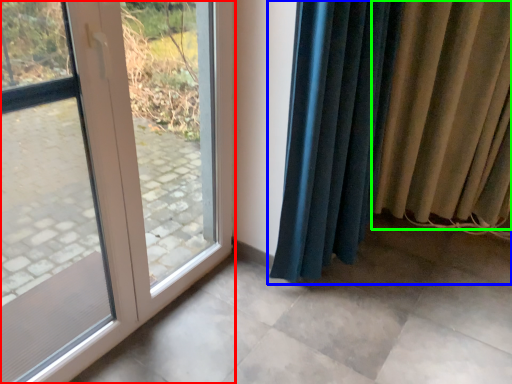
Question: Based on their relative distances, which object is farther from door (highlighted by a red box)? Choose from curtain (highlighted by a blue box) and curtain (highlighted by a green box).

Choices:
 (A) curtain
 (B) curtain

Answer: (A)